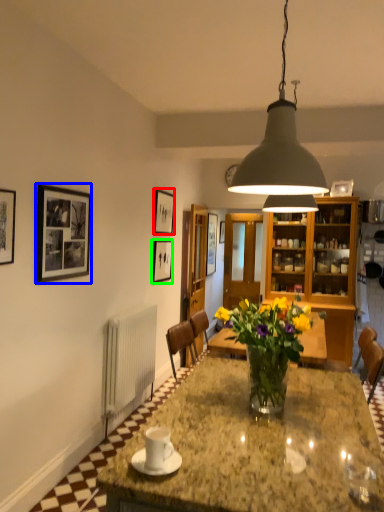
Question: Which is nearer to the picture frame (highlighted by a red box)? picture frame (highlighted by a blue box) or picture frame (highlighted by a green box).

Choices:
 (A) picture frame
 (B) picture frame

Answer: (B)